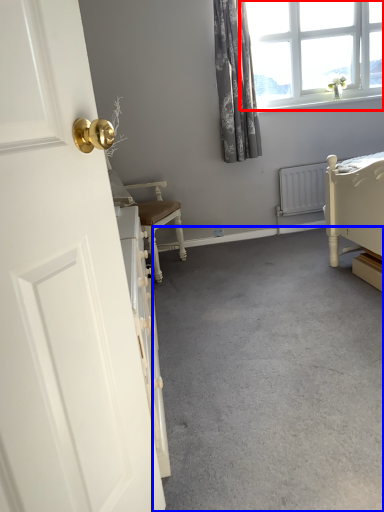
Question: Which object appears closest to the camera in this image, window (highlighted by a red box) or concrete (highlighted by a blue box)?

Choices:
 (A) window
 (B) concrete

Answer: (B)